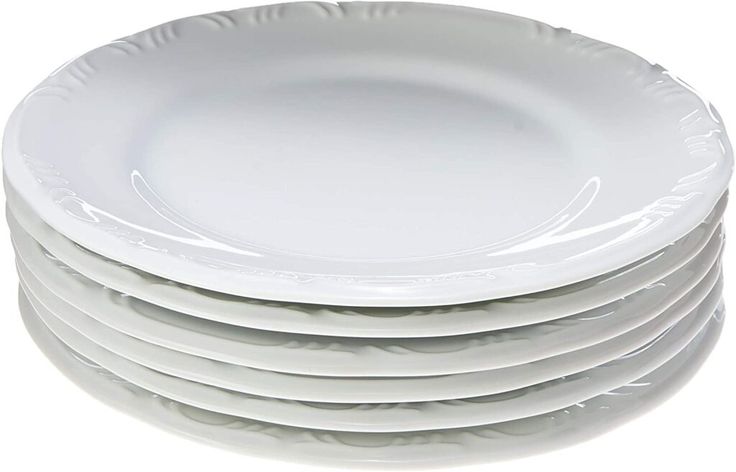
This screenshot has height=472, width=736. What are the coordinates of `plates` in the screenshot? It's located at (413, 297), (413, 324), (416, 352), (413, 402), (419, 424), (411, 471).